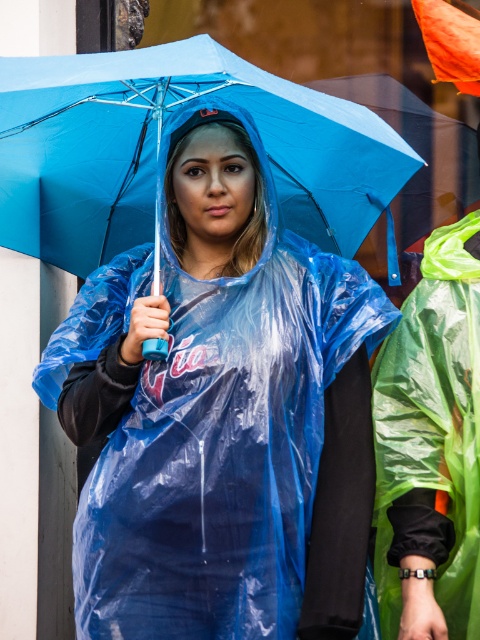
Which of these two, transparent plastic umbrella at center or blue matte umbrella at center, stands taller?

blue matte umbrella at center

Who is more distant from viewer, (350, 250) or (469, 189)?

Point (469, 189)

What do you see at coordinates (158, 147) in the screenshot? The height and width of the screenshot is (640, 480). I see `transparent plastic umbrella at center` at bounding box center [158, 147].

Find the location of a particular element. transparent plastic umbrella at center is located at coordinates (158, 147).

Looking at this image, is transparent plastic raincoat at center further to camera compared to transparent plastic umbrella at center?

Yes, it is behind transparent plastic umbrella at center.

Is point (287, 394) less distant than point (376, 166)?

Yes.

Locate an element on the screen. transparent plastic raincoat at center is located at coordinates (211, 410).

Is transparent plastic raincoat at center shorter than blue matte umbrella at center?

No.

Can you confirm if transparent plastic raincoat at center is positioned to the right of blue matte umbrella at center?

No, transparent plastic raincoat at center is not to the right of blue matte umbrella at center.

Does point (159, 536) lie behind point (360, 262)?

No, it is not.

You are a GUI agent. You are given a task and a screenshot of the screen. Output one action in this format:
    pyautogui.click(x=<x>, y=<y>)
    Task: Click on the transparent plastic raincoat at center
    
    Given the screenshot: What is the action you would take?
    pyautogui.click(x=211, y=410)